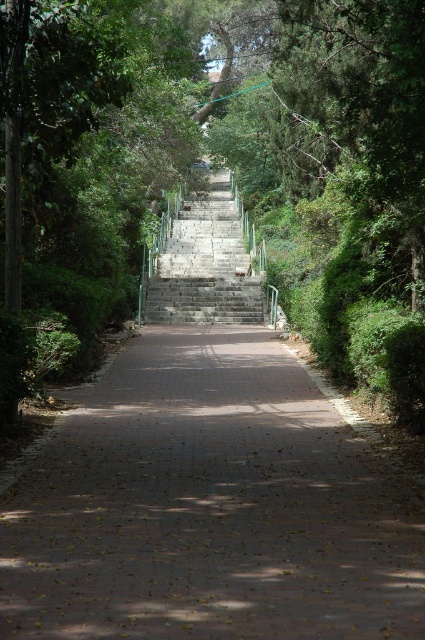
Question: Can you confirm if brown brick path at center is wider than gray stone stairs at center?

Choices:
 (A) no
 (B) yes

Answer: (A)

Question: Which point appears farthest from the camera in this image?

Choices:
 (A) (227, 173)
 (B) (184, 333)

Answer: (A)

Question: Which point is closer to the camera taking this photo?

Choices:
 (A) (246, 310)
 (B) (70, 620)

Answer: (B)

Question: Can you confirm if brown brick path at center is positioned below gray stone stairs at center?

Choices:
 (A) no
 (B) yes

Answer: (B)

Question: Which point is farther from the camera taking this photo?

Choices:
 (A) (25, 608)
 (B) (237, 276)

Answer: (B)

Question: Does brown brick path at center appear on the right side of gray stone stairs at center?

Choices:
 (A) no
 (B) yes

Answer: (B)